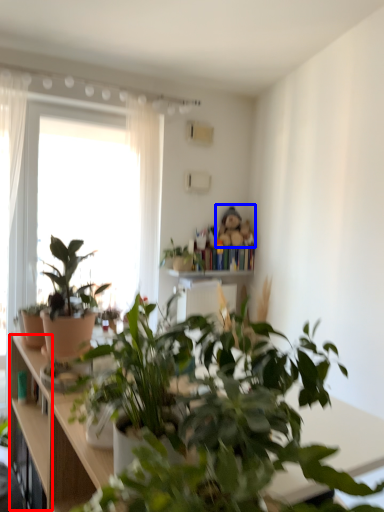
Question: Which object appears closest to the camera in this image, cabinet (highlighted by a red box) or toy (highlighted by a blue box)?

Choices:
 (A) cabinet
 (B) toy

Answer: (A)